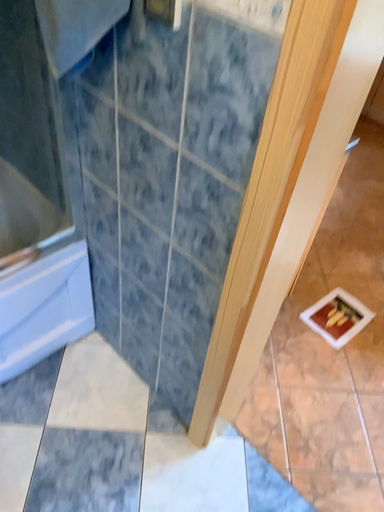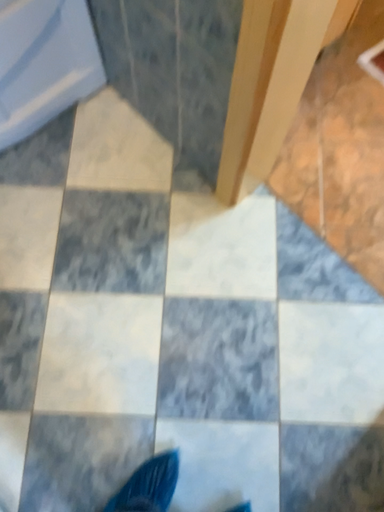
Question: Which way did the camera rotate in the video?

Choices:
 (A) rotated upward
 (B) rotated downward

Answer: (B)